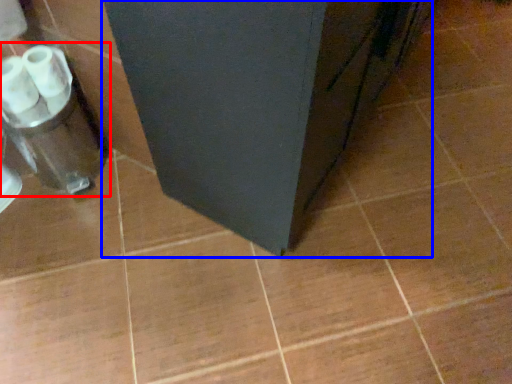
Question: Which of the following is the closest to the observer, blender (highlighted by a red box) or furniture (highlighted by a blue box)?

Choices:
 (A) blender
 (B) furniture

Answer: (B)